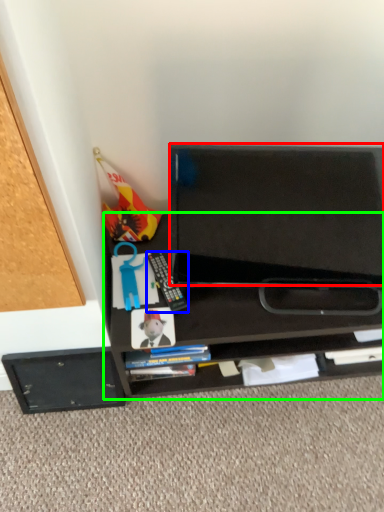
Question: Which is farther away from back (highlighted by a red box)? equipment (highlighted by a blue box) or desk (highlighted by a green box)?

Choices:
 (A) equipment
 (B) desk

Answer: (A)